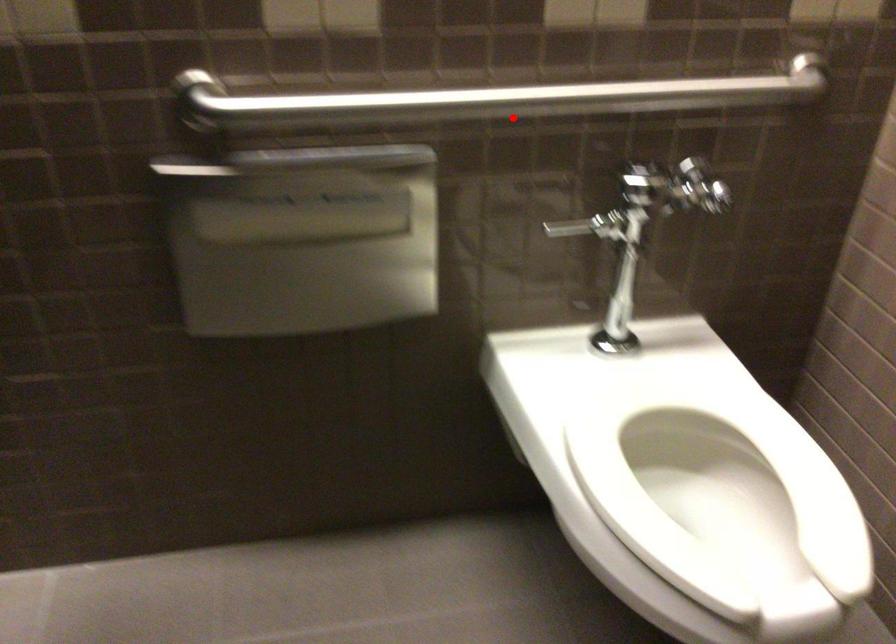
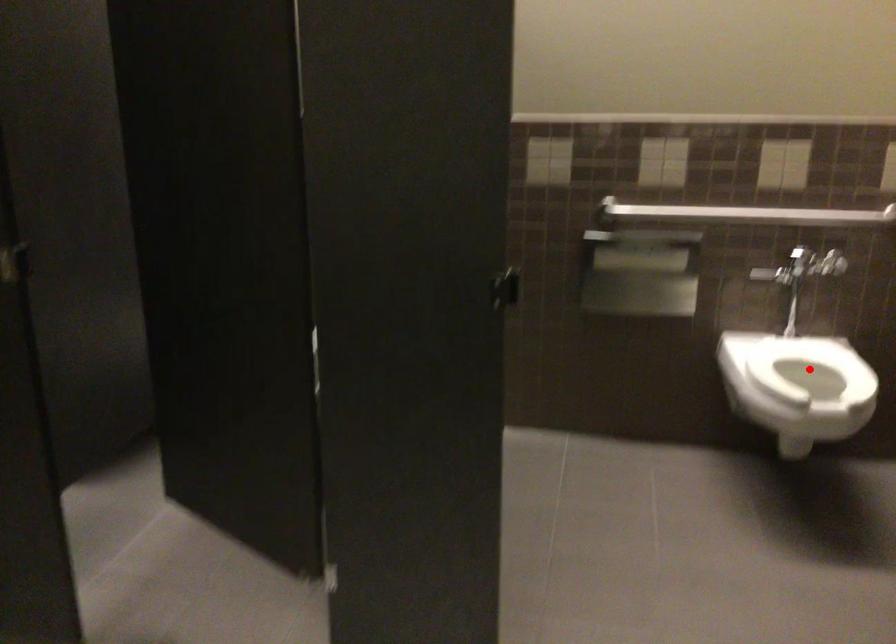
I am providing you with two images of the same scene from different viewpoints. A red point is marked on the first image and another point is marked on the second image. Do the highlighted points in image1 and image2 indicate the same real-world spot?

No